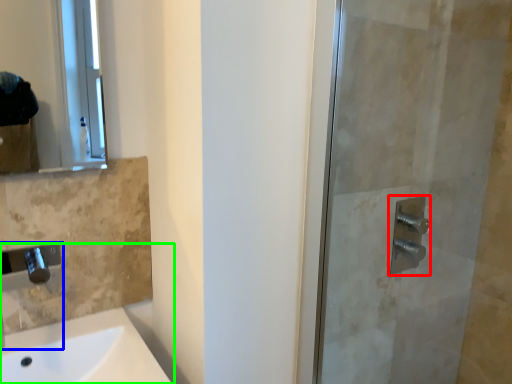
Question: Estimate the real-world distances between objects in this image. Which object is farther from shower (highlighted by a red box), faucet (highlighted by a blue box) or sink (highlighted by a green box)?

Choices:
 (A) faucet
 (B) sink

Answer: (A)